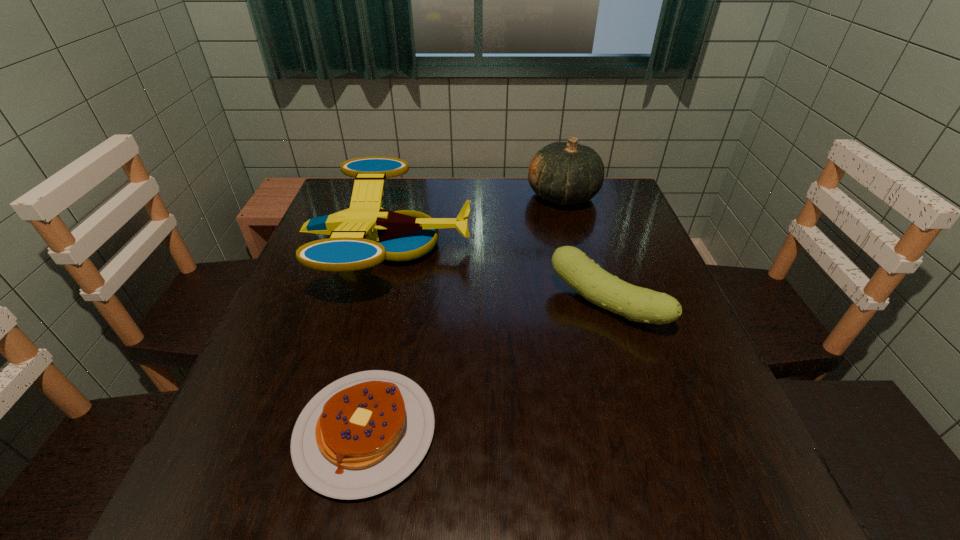
Image resolution: width=960 pixels, height=540 pixels. I want to click on vacant space that satisfies the following two spatial constraints: 1. at the cockpit of the drone; 2. on the right side of the shortest object, so [343, 431].

This screenshot has width=960, height=540. In order to click on free space that satisfies the following two spatial constraints: 1. at the cockpit of the second tallest object; 2. on the back side of the cucumber in this screenshot , I will do `click(374, 305)`.

The height and width of the screenshot is (540, 960). I want to click on vacant region that satisfies the following two spatial constraints: 1. at the cockpit of the second tallest object; 2. on the back side of the second shortest object, so click(374, 305).